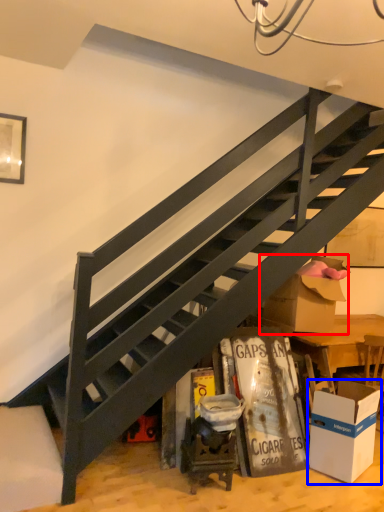
Question: Which point is further to the camera, cardboard box (highlighted by a red box) or box (highlighted by a blue box)?

Choices:
 (A) cardboard box
 (B) box

Answer: (A)